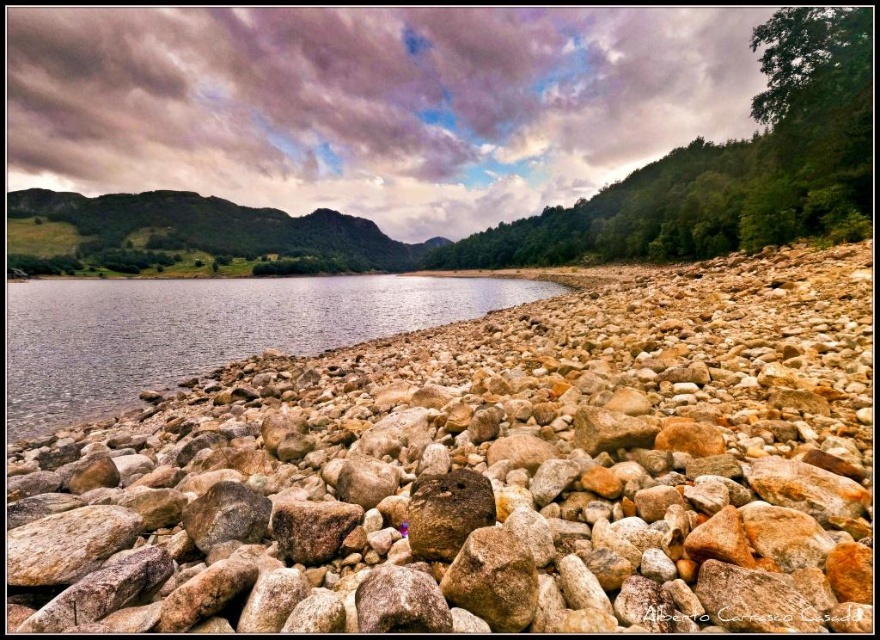
Question: Which object appears farthest from the camera in this image?

Choices:
 (A) clear water at shore left
 (B) brown rough rock at center

Answer: (A)

Question: Which of the following is the closest to the observer?

Choices:
 (A) brown rough rock at center
 (B) brown rocky shoreline at lower left

Answer: (B)

Question: Does clear water at shore left lie in front of brown rough rock at center?

Choices:
 (A) no
 (B) yes

Answer: (A)

Question: Estimate the real-world distances between objects in this image. Which object is farther from the clear water at shore left?

Choices:
 (A) brown rocky shoreline at lower left
 (B) brown rough rock at center

Answer: (B)

Question: Can you confirm if brown rocky shoreline at lower left is bigger than brown rough rock at center?

Choices:
 (A) yes
 (B) no

Answer: (A)

Question: Considering the relative positions of brown rocky shoreline at lower left and clear water at shore left in the image provided, where is brown rocky shoreline at lower left located with respect to clear water at shore left?

Choices:
 (A) above
 (B) below

Answer: (B)